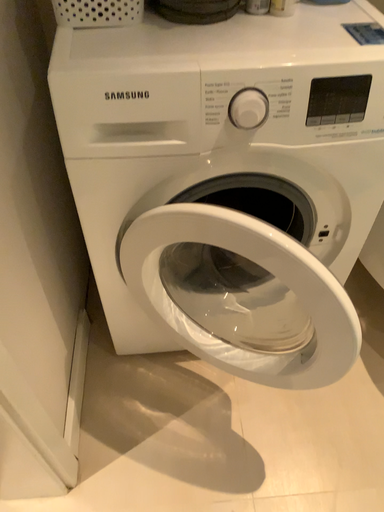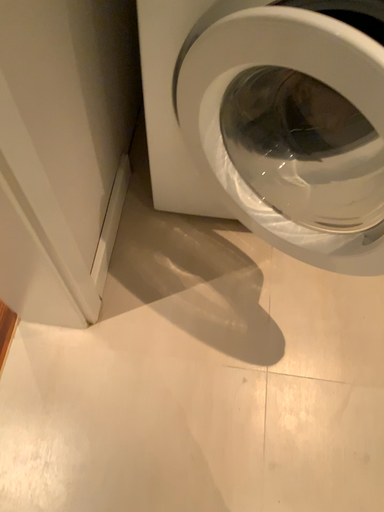
Question: How did the camera likely rotate when shooting the video?

Choices:
 (A) rotated upward
 (B) rotated downward

Answer: (B)